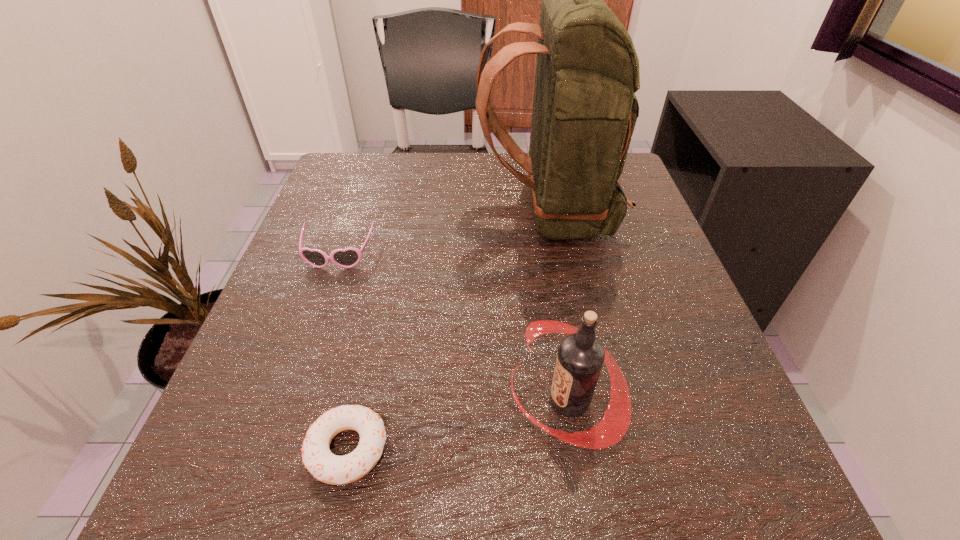
Find the location of a particular element. This screenshot has width=960, height=540. free spot located on the front-facing side of the second shortest object is located at coordinates (261, 476).

At what (x,y) coordinates should I click in order to perform the action: click on vacant region located on the back of the doughnut. Please return your answer as a coordinate pair (x, y). This screenshot has height=540, width=960. Looking at the image, I should click on (378, 309).

The width and height of the screenshot is (960, 540). I want to click on object situated at the far edge, so click(x=584, y=113).

Identify the location of root beer located at the near edge. coord(580,357).

Locate an element on the screen. doughnut that is at the near edge is located at coordinates (326, 467).

This screenshot has height=540, width=960. I want to click on sunglasses situated at the left edge, so click(x=347, y=258).

Locate an element on the screen. This screenshot has height=540, width=960. doughnut that is at the left edge is located at coordinates (326, 467).

This screenshot has width=960, height=540. Find the location of `backpack present at the right edge`. backpack present at the right edge is located at coordinates (584, 113).

Identify the location of root beer that is at the right edge. This screenshot has height=540, width=960. (580, 357).

Locate an element on the screen. The width and height of the screenshot is (960, 540). object that is at the near left corner is located at coordinates (326, 467).